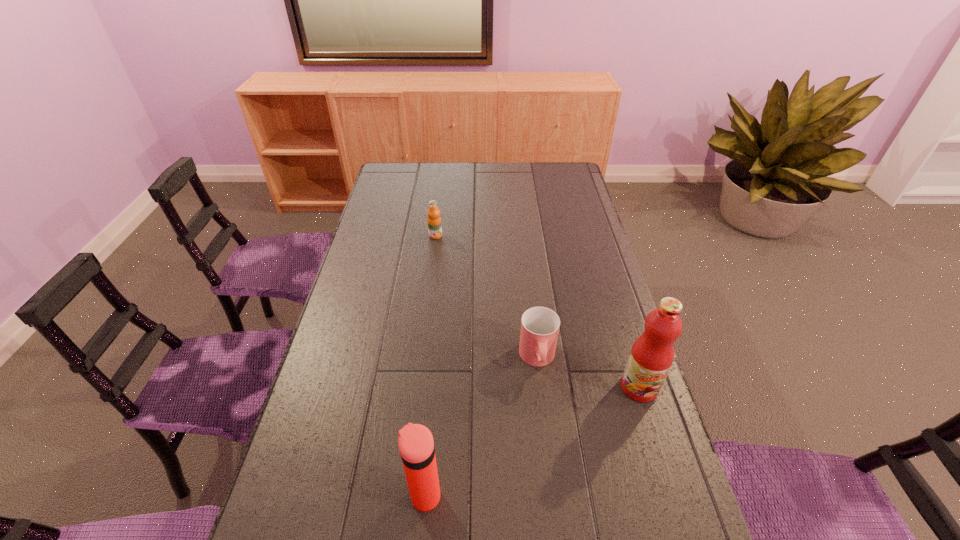
Locate an element on the screen. Image resolution: width=960 pixels, height=540 pixels. free space located 0.140m on the side of the second object from right to left with the handle is located at coordinates (546, 428).

Locate an element on the screen. This screenshot has height=540, width=960. vacant region located on the label of the orange juice is located at coordinates (472, 293).

Find the location of a particular element. Image resolution: width=960 pixels, height=540 pixels. vacant area situated 0.240m on the label of the orange juice is located at coordinates (463, 278).

Locate an element on the screen. Image resolution: width=960 pixels, height=540 pixels. vacant space positioned 0.170m on the label of the orange juice is located at coordinates click(x=455, y=266).

Locate an element on the screen. object located in the near edge section of the desktop is located at coordinates (416, 445).

This screenshot has width=960, height=540. Find the location of `object situated at the right edge`. object situated at the right edge is located at coordinates (652, 354).

This screenshot has height=540, width=960. In the image, there is a desktop. In order to click on vacant space at the far edge in this screenshot , I will do `click(421, 185)`.

This screenshot has height=540, width=960. Find the location of `free region at the left edge of the desktop`. free region at the left edge of the desktop is located at coordinates (332, 412).

At what (x,y) coordinates should I click in order to perform the action: click on free spot at the right edge of the desktop. Please return your answer as a coordinate pair (x, y). The image size is (960, 540). Looking at the image, I should click on (600, 283).

I want to click on blank space at the far left corner, so click(x=394, y=178).